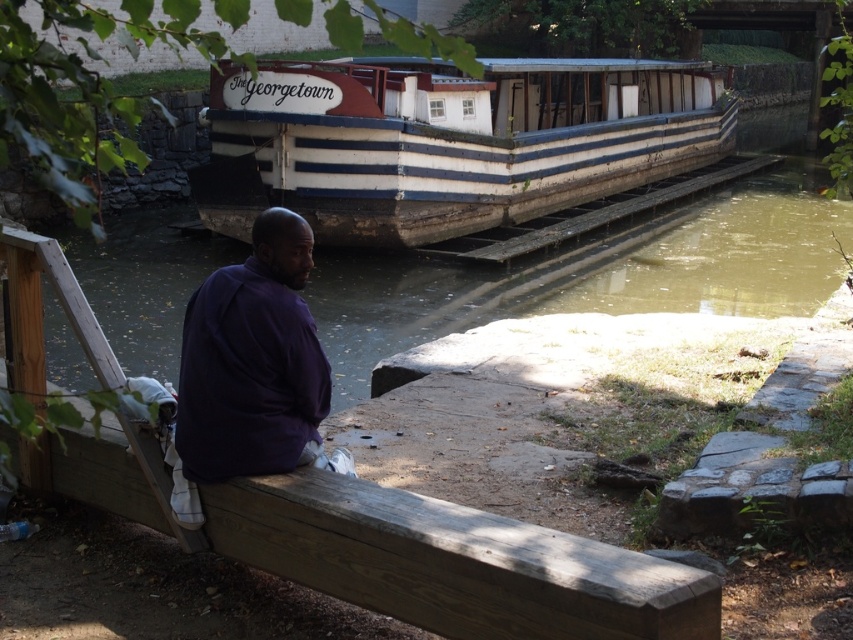
You are standing at the edge of the wooden railing near the man and want to look at two points in the scene. The first point is at coordinates point (471, 92) and the second point is at point (172, 259). Which point is closer to you?

Point (471, 92) is further to the camera than point (172, 259), so the second point is closer to you.